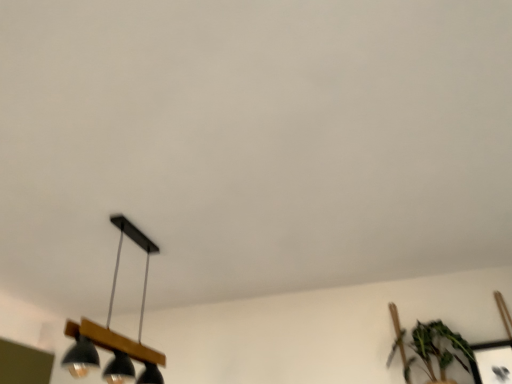
Image resolution: width=512 pixels, height=384 pixels. What do you see at coordinates (115, 333) in the screenshot?
I see `black matte/wooden lamp at lower left` at bounding box center [115, 333].

Describe the element at coordinates (492, 362) in the screenshot. I see `metallic silver picture frame at lower right` at that location.

The width and height of the screenshot is (512, 384). In order to click on green leafy plant at lower right in this screenshot , I will do `click(438, 347)`.

From a real-world perspective, who is located higher, metallic silver picture frame at lower right or black matte/wooden lamp at lower left?

black matte/wooden lamp at lower left.

Is metallic silver picture frame at lower right in front of black matte/wooden lamp at lower left?

No, it is behind black matte/wooden lamp at lower left.

Where is `picture frame below the black matte/wooden lamp at lower left (from a real-world perspective)`? Image resolution: width=512 pixels, height=384 pixels. picture frame below the black matte/wooden lamp at lower left (from a real-world perspective) is located at coordinates pos(492,362).

Do you think metallic silver picture frame at lower right is within black matte/wooden lamp at lower left, or outside of it?

metallic silver picture frame at lower right cannot be found inside black matte/wooden lamp at lower left.

Can you confirm if metallic silver picture frame at lower right is bigger than green leafy plant at lower right?

No, metallic silver picture frame at lower right is not bigger than green leafy plant at lower right.

Is green leafy plant at lower right located within metallic silver picture frame at lower right?

No, metallic silver picture frame at lower right does not contain green leafy plant at lower right.

In the scene shown: Is metallic silver picture frame at lower right facing away from green leafy plant at lower right?

No.

Consider the image. From a real-world perspective, is metallic silver picture frame at lower right below green leafy plant at lower right?

Yes, from a real-world perspective, metallic silver picture frame at lower right is under green leafy plant at lower right.

How much distance is there between black matte/wooden lamp at lower left and metallic silver picture frame at lower right?

black matte/wooden lamp at lower left is 1.89 meters away from metallic silver picture frame at lower right.

Is black matte/wooden lamp at lower left next to metallic silver picture frame at lower right and touching it?

No, black matte/wooden lamp at lower left is not in contact with metallic silver picture frame at lower right.

Between point (116, 366) and point (495, 372), which one is positioned in front?

The point (116, 366) is closer to the camera.

Image resolution: width=512 pixels, height=384 pixels. In order to click on picture frame directly beneath the black matte/wooden lamp at lower left (from a real-world perspective) in this screenshot , I will do `click(492, 362)`.

Can you confirm if green leafy plant at lower right is shorter than black matte/wooden lamp at lower left?

Yes.

Is green leafy plant at lower right situated inside black matte/wooden lamp at lower left or outside?

green leafy plant at lower right exists outside the volume of black matte/wooden lamp at lower left.

Which object is wider, green leafy plant at lower right or black matte/wooden lamp at lower left?

green leafy plant at lower right is wider.

Which is less distant, [445,333] or [134,349]?

Point [445,333] appears to be farther away from the viewer than point [134,349].

Does black matte/wooden lamp at lower left turn towards green leafy plant at lower right?

No, black matte/wooden lamp at lower left is not aimed at green leafy plant at lower right.

Is black matte/wooden lamp at lower left shorter than green leafy plant at lower right?

Incorrect, the height of black matte/wooden lamp at lower left does not fall short of that of green leafy plant at lower right.

Which of these two, black matte/wooden lamp at lower left or green leafy plant at lower right, is wider?

green leafy plant at lower right.

Considering the relative positions of black matte/wooden lamp at lower left and green leafy plant at lower right in the image provided, is black matte/wooden lamp at lower left to the left of green leafy plant at lower right from the viewer's perspective?

Yes.

Does green leafy plant at lower right turn towards metallic silver picture frame at lower right?

No, green leafy plant at lower right is not oriented towards metallic silver picture frame at lower right.

Considering the relative sizes of green leafy plant at lower right and metallic silver picture frame at lower right in the image provided, is green leafy plant at lower right bigger than metallic silver picture frame at lower right?

Correct, green leafy plant at lower right is larger in size than metallic silver picture frame at lower right.

Is point (395, 345) closer or farther from the camera than point (490, 373)?

Point (395, 345) appears to be farther away from the viewer than point (490, 373).

Considering the sizes of objects green leafy plant at lower right and metallic silver picture frame at lower right in the image provided, who is wider, green leafy plant at lower right or metallic silver picture frame at lower right?

With larger width is green leafy plant at lower right.

This screenshot has height=384, width=512. What are the coordinates of `picture frame that is below the black matte/wooden lamp at lower left (from the image's perspective)` in the screenshot? It's located at (492, 362).

The width and height of the screenshot is (512, 384). In order to click on houseplant in front of the metallic silver picture frame at lower right in this screenshot , I will do `click(438, 347)`.

Considering their positions, is green leafy plant at lower right positioned further to black matte/wooden lamp at lower left than metallic silver picture frame at lower right?

metallic silver picture frame at lower right is further to black matte/wooden lamp at lower left.

When comparing their distances from green leafy plant at lower right, does metallic silver picture frame at lower right or black matte/wooden lamp at lower left seem closer?

metallic silver picture frame at lower right.

From the image, which object appears to be nearer to black matte/wooden lamp at lower left, metallic silver picture frame at lower right or green leafy plant at lower right?

Among the two, green leafy plant at lower right is located nearer to black matte/wooden lamp at lower left.

Based on their spatial positions, is black matte/wooden lamp at lower left or metallic silver picture frame at lower right further from green leafy plant at lower right?

The object further to green leafy plant at lower right is black matte/wooden lamp at lower left.

Considering their positions, is green leafy plant at lower right positioned closer to metallic silver picture frame at lower right than black matte/wooden lamp at lower left?

The object closer to metallic silver picture frame at lower right is green leafy plant at lower right.

Looking at the image, which one is located further to metallic silver picture frame at lower right, black matte/wooden lamp at lower left or green leafy plant at lower right?

Based on the image, black matte/wooden lamp at lower left appears to be further to metallic silver picture frame at lower right.

Image resolution: width=512 pixels, height=384 pixels. Find the location of `houseplant situated between black matte/wooden lamp at lower left and metallic silver picture frame at lower right from left to right`. houseplant situated between black matte/wooden lamp at lower left and metallic silver picture frame at lower right from left to right is located at coordinates (438, 347).